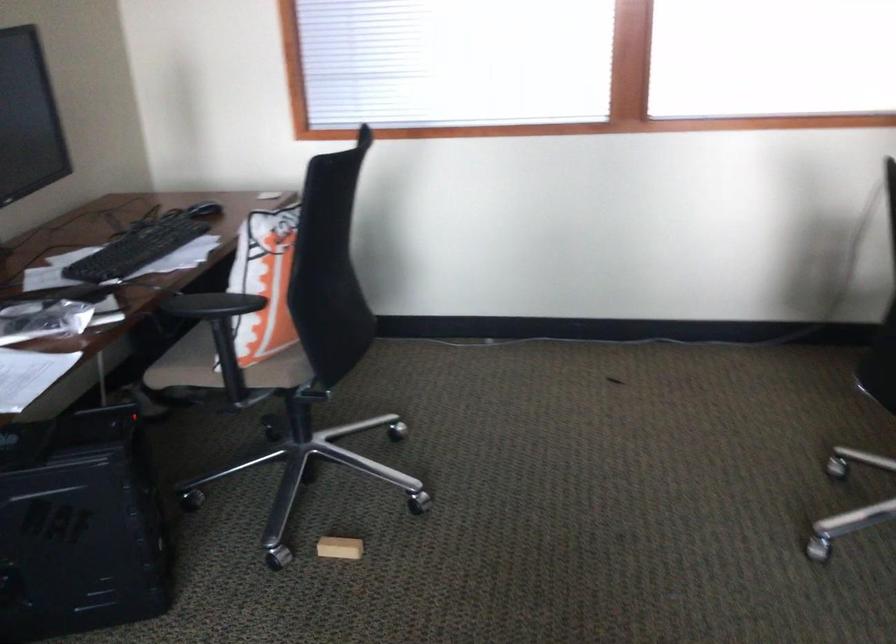
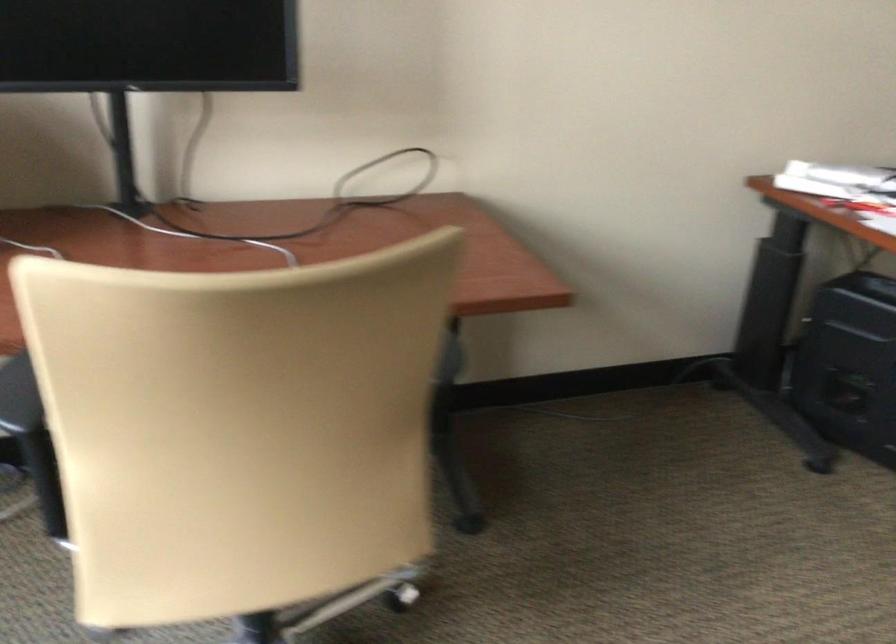
First-person continuous shooting, in which direction is the camera rotating?

The camera rotated toward left-down.